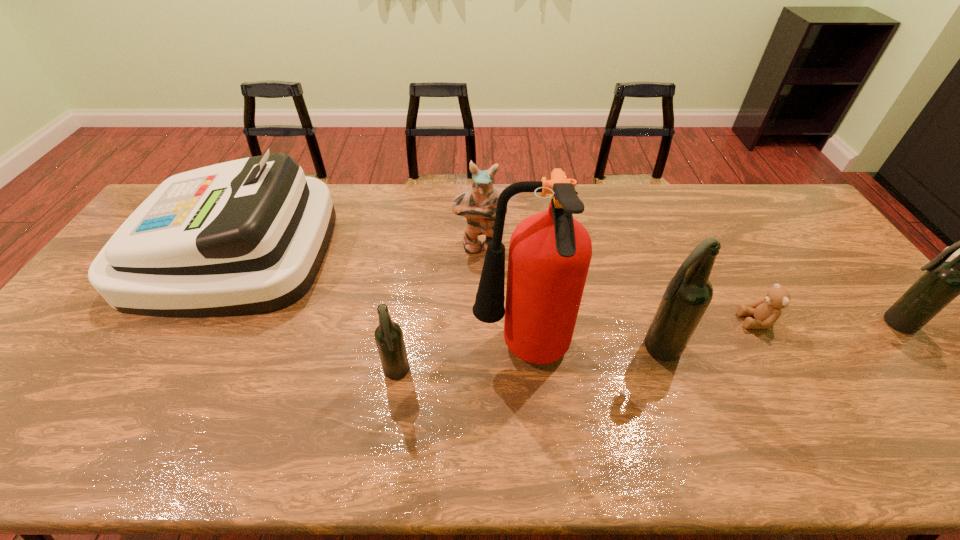
Identify the location of the second shortest object. (388, 335).

Image resolution: width=960 pixels, height=540 pixels. Find the location of `the sixth object from right to left`. the sixth object from right to left is located at coordinates (388, 335).

Locate an element on the screen. the fifth object from left to right is located at coordinates (688, 294).

Where is `the sixth shortest object`? This screenshot has height=540, width=960. the sixth shortest object is located at coordinates (688, 294).

Find the location of `the rightmost object`. the rightmost object is located at coordinates (943, 281).

What are the coordinates of `the rightmost beer bottle` in the screenshot? It's located at (943, 281).

Find the location of a particular element. cash register is located at coordinates (248, 236).

Identify the location of figurine. The image size is (960, 540). (x=478, y=205).

Find the location of `the shortest object`. the shortest object is located at coordinates (766, 311).

What are the coordinates of `teddy bear` in the screenshot? It's located at (766, 311).